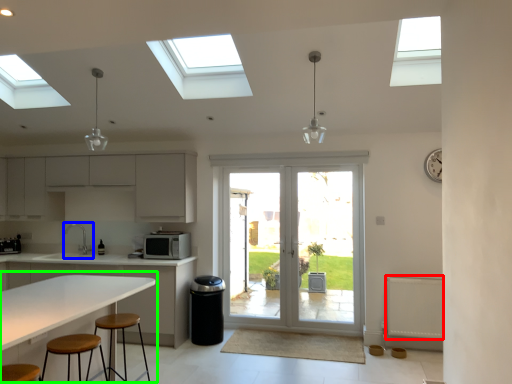
Question: Which is farther away from radiator (highlighted by a red box)? sink (highlighted by a blue box) or table (highlighted by a green box)?

Choices:
 (A) sink
 (B) table

Answer: (A)